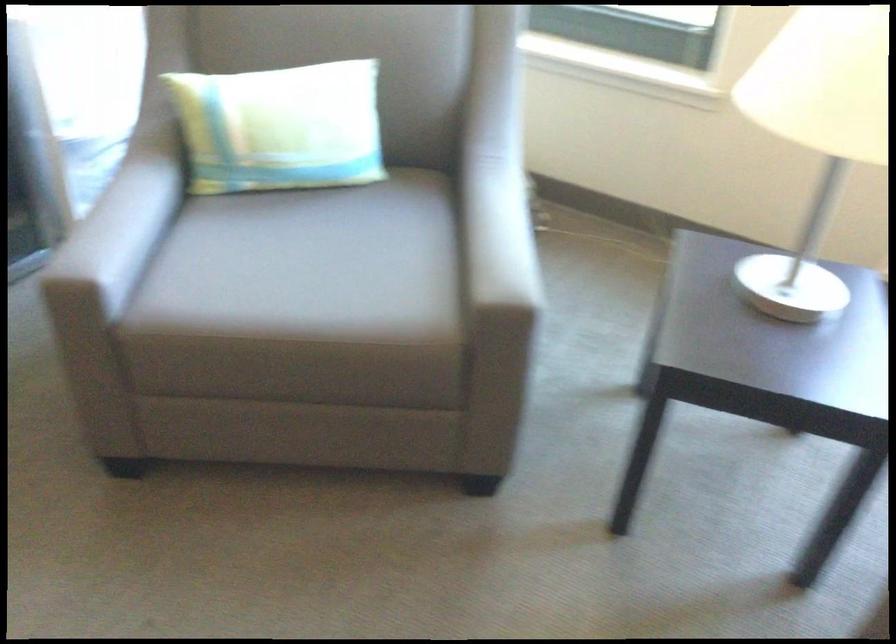
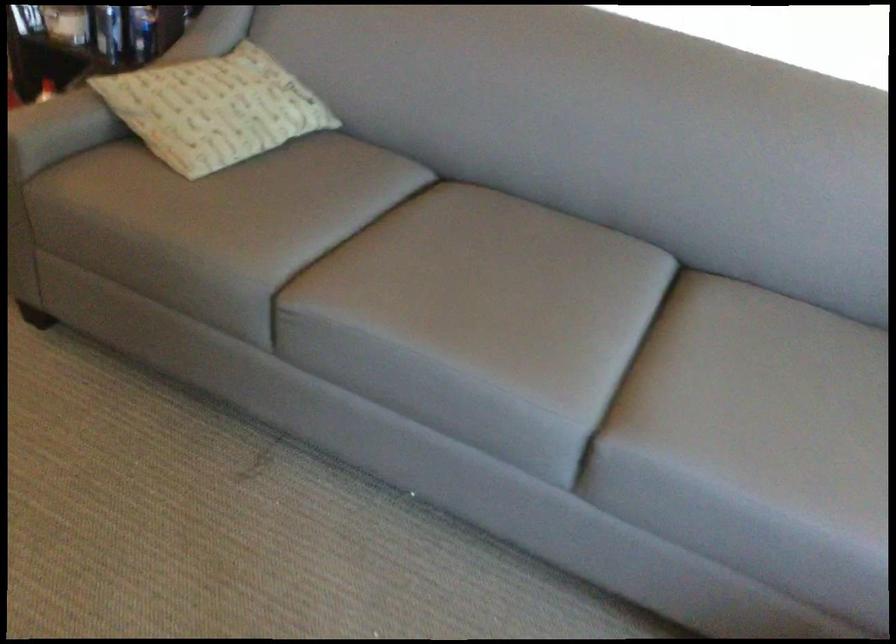
Question: The camera is either moving clockwise (left) or counter-clockwise (right) around the object. The first image is from the beginning of the video and the second image is from the end. Is the camera moving left or right when shooting the video?

Choices:
 (A) Left
 (B) Right

Answer: (B)